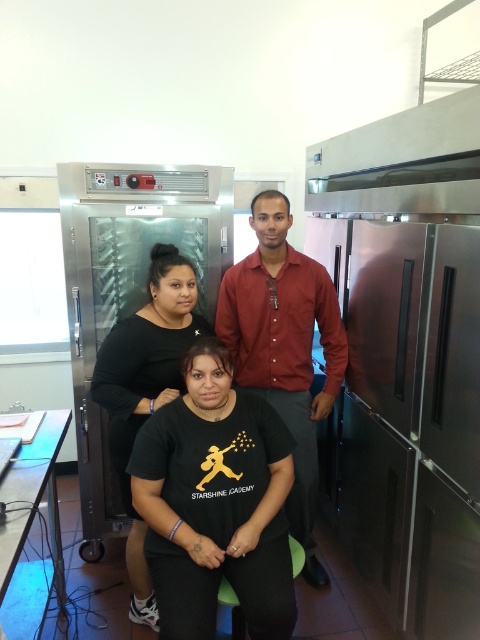
Is matte red shirt at center thinner than black matte dress at center?

Incorrect, matte red shirt at center's width is not less than black matte dress at center's.

Does matte red shirt at center appear on the right side of black matte dress at center?

Yes, matte red shirt at center is to the right of black matte dress at center.

Where is `matte red shirt at center`? The width and height of the screenshot is (480, 640). matte red shirt at center is located at coordinates click(x=285, y=348).

Is black matte t-shirt at center taller than black matte shirt at center?

In fact, black matte t-shirt at center may be shorter than black matte shirt at center.

Does black matte t-shirt at center appear on the left side of black matte shirt at center?

Yes, black matte t-shirt at center is to the left of black matte shirt at center.

Locate an element on the screen. black matte t-shirt at center is located at coordinates (216, 502).

Where is `black matte t-shirt at center`? black matte t-shirt at center is located at coordinates (216, 502).

Is black matte t-shirt at center behind black matte dress at center?

That is False.

Is black matte t-shirt at center to the right of black matte dress at center from the viewer's perspective?

Correct, you'll find black matte t-shirt at center to the right of black matte dress at center.

Where is `black matte t-shirt at center`? The height and width of the screenshot is (640, 480). black matte t-shirt at center is located at coordinates (216, 502).